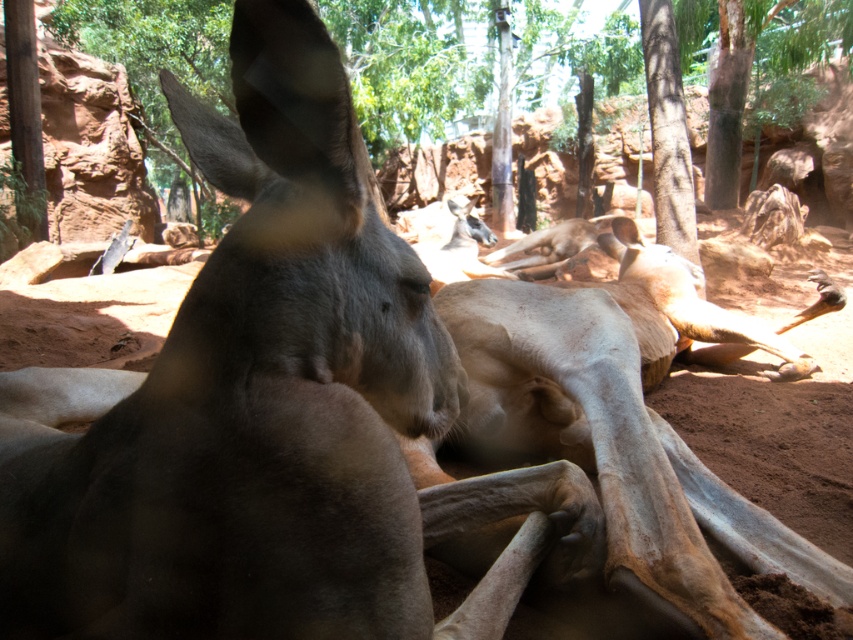
Is brown fur kangaroo at center taller than brown rough tree at upper center?

In fact, brown fur kangaroo at center may be shorter than brown rough tree at upper center.

Does brown fur kangaroo at center come behind brown rough tree at upper center?

No.

What do you see at coordinates (265, 410) in the screenshot? Image resolution: width=853 pixels, height=640 pixels. I see `brown fur kangaroo at center` at bounding box center [265, 410].

At what (x,y) coordinates should I click in order to perform the action: click on brown fur kangaroo at center. Please return your answer as a coordinate pair (x, y). This screenshot has height=640, width=853. Looking at the image, I should click on (265, 410).